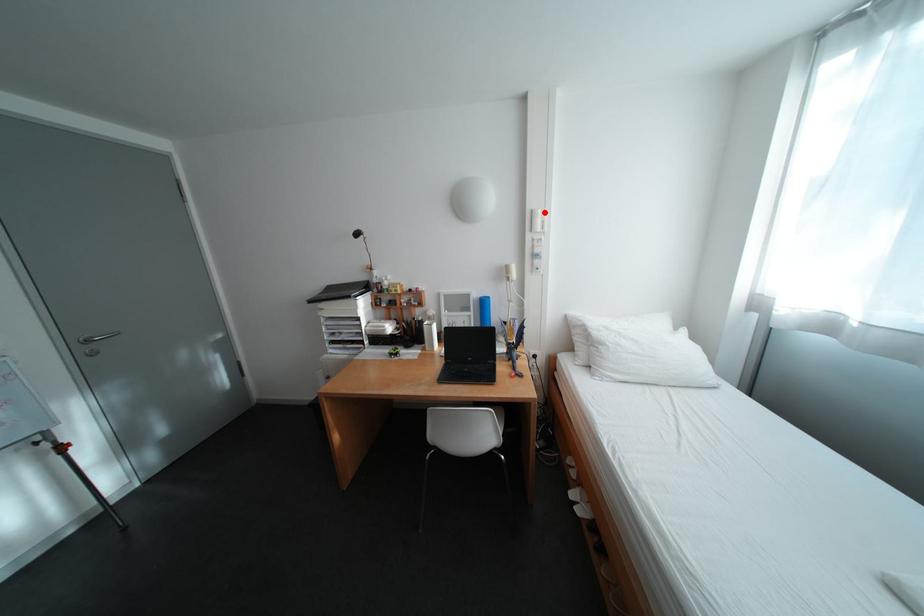
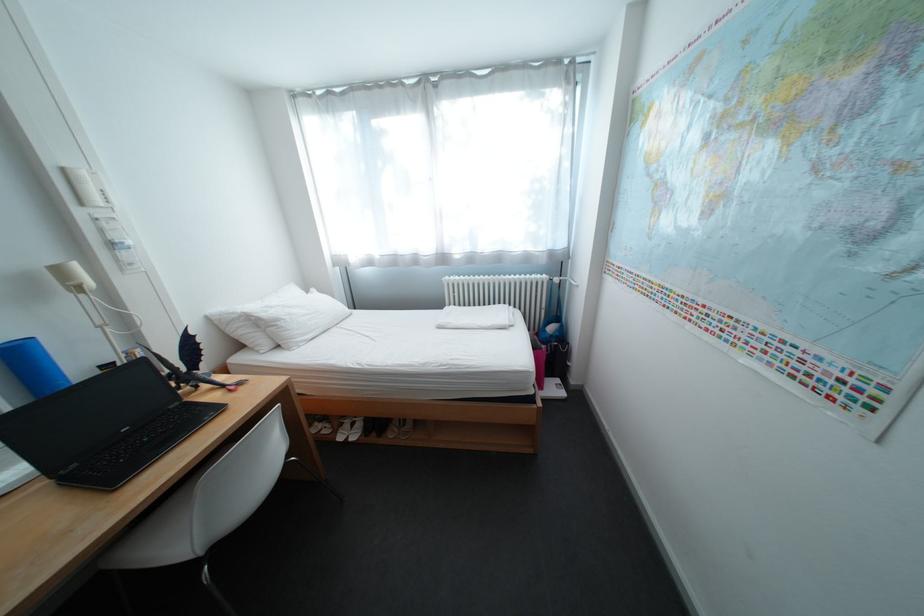
Question: I am providing you with two images of the same scene from different viewpoints. Given a red point in image1, look at the same physical point in image2. Is it:

Choices:
 (A) Closer to the viewpoint
 (B) Farther from the viewpoint

Answer: (B)